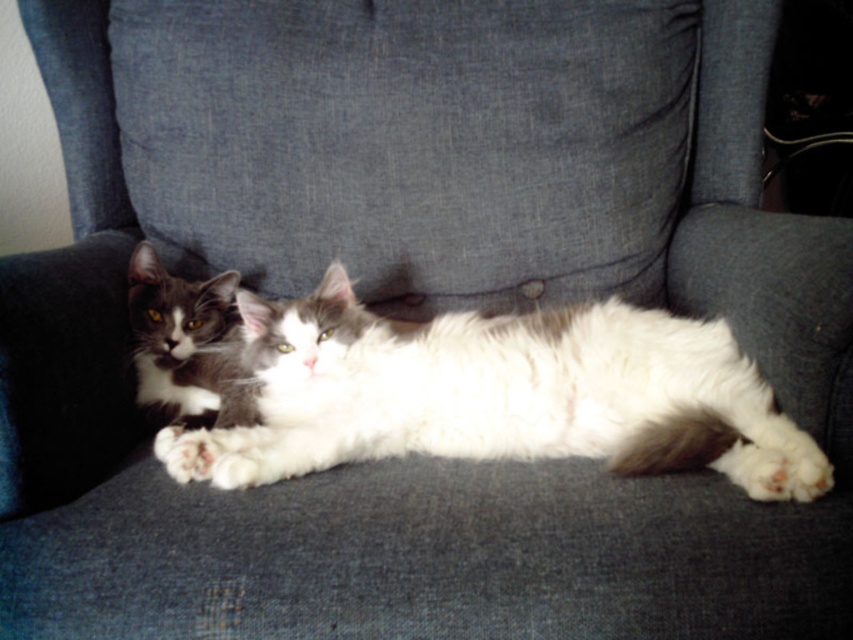
Question: Does white fluffy cat at center appear over gray fur cat at left?

Choices:
 (A) no
 (B) yes

Answer: (A)

Question: Does white fluffy cat at center appear on the right side of gray fur cat at left?

Choices:
 (A) yes
 (B) no

Answer: (A)

Question: Is white fluffy cat at center further to camera compared to gray fur cat at left?

Choices:
 (A) yes
 (B) no

Answer: (B)